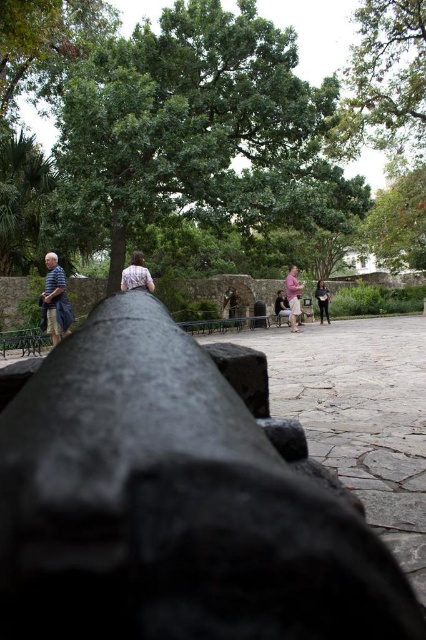
Question: Which point is closer to the camera?

Choices:
 (A) pink fabric shirt at center
 (B) black matte cannon at center
 (C) matte black jacket at center
 (D) light brown leather jacket at center

Answer: (B)

Question: Does black matte cannon at center appear on the right side of pink fabric shirt at center?

Choices:
 (A) no
 (B) yes

Answer: (A)

Question: Estimate the real-world distances between objects in this image. Which object is farther from the dark gray pants at center?

Choices:
 (A) black matte cannon at center
 (B) matte black jacket at center

Answer: (A)

Question: Observing the image, what is the correct spatial positioning of pink fabric shirt at center in reference to matte black jacket at center?

Choices:
 (A) below
 (B) above

Answer: (B)

Question: Can you confirm if black matte cannon at center is positioned above light brown leather jacket at center?

Choices:
 (A) yes
 (B) no

Answer: (B)

Question: Which of the following is the closest to the observer?

Choices:
 (A) dark blue shirt at left
 (B) light brown leather jacket at center
 (C) light brown wooden bench at center
 (D) matte black jacket at center

Answer: (A)